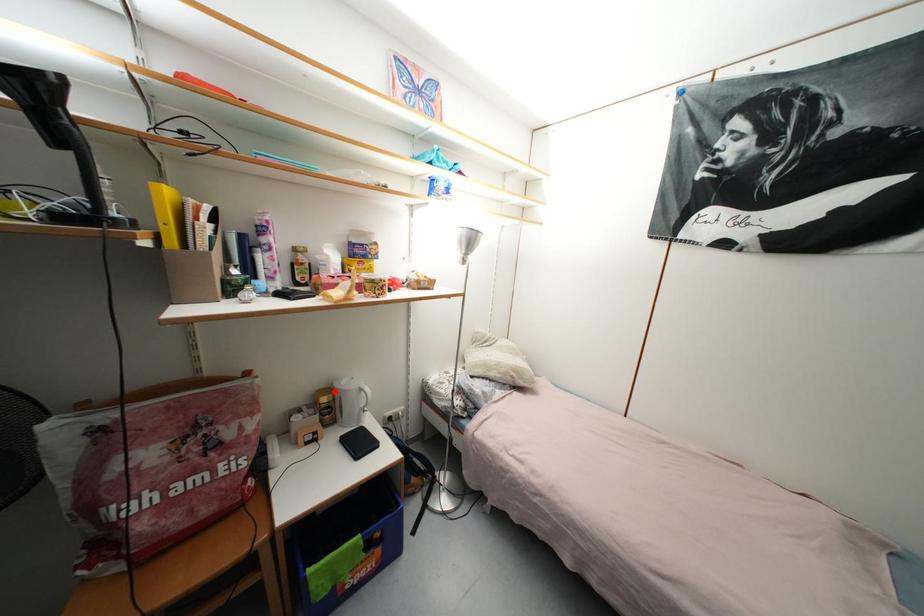
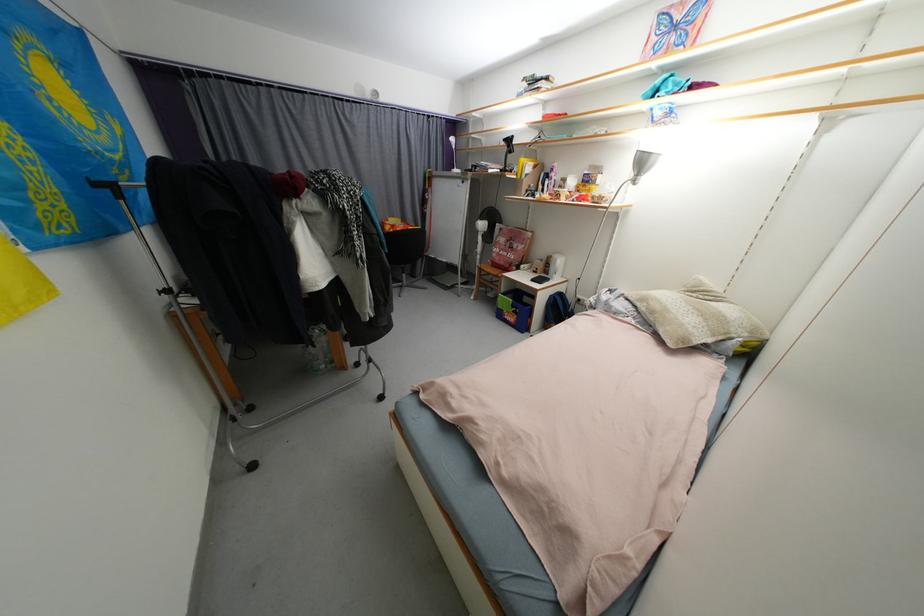
Find the pixel in the second image that matches the highlighted location in the first image.

(557, 257)